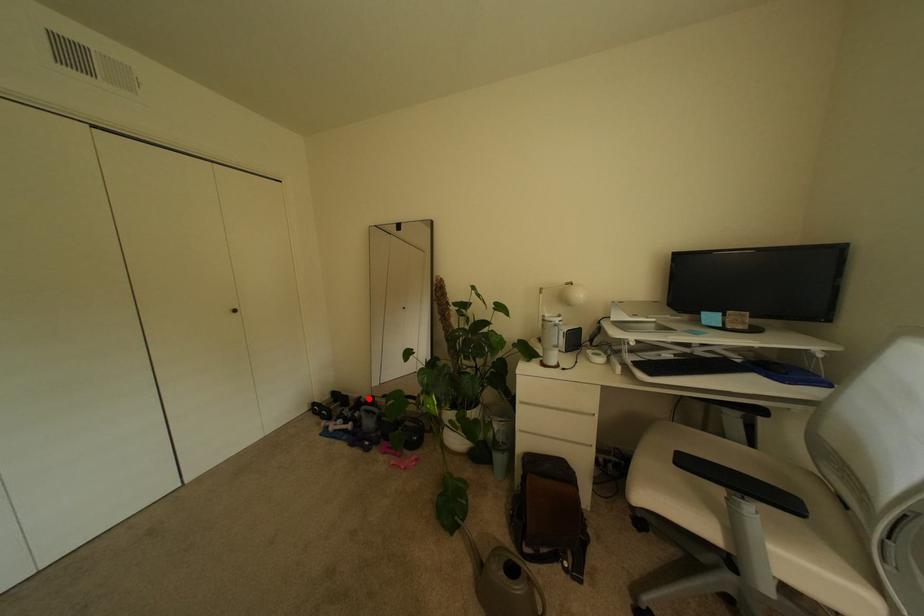
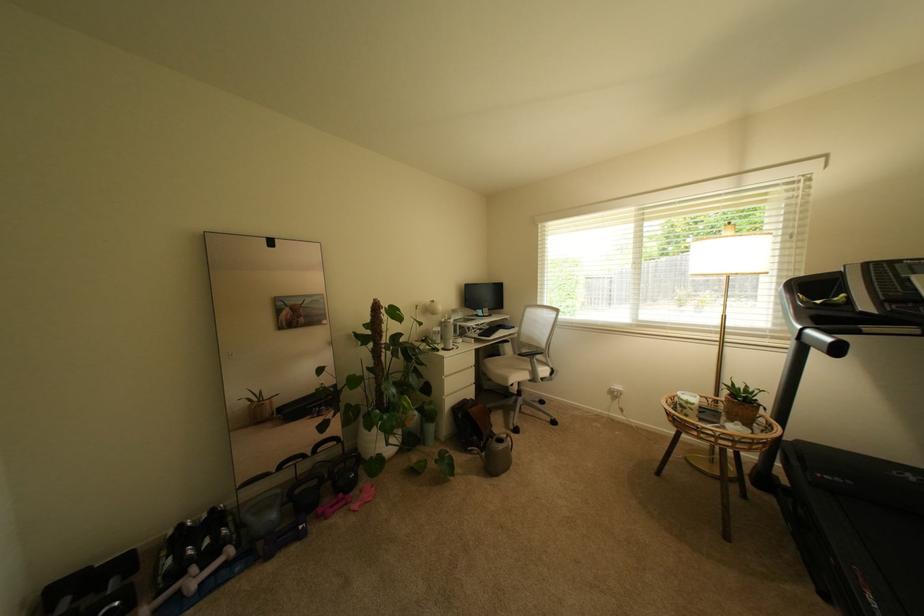
Question: I am providing you with two images of the same scene from different viewpoints. A red point is shown in image1. For the corresponding object point in image2, is it positioned nearer or farther from the camera?

Choices:
 (A) Nearer
 (B) Farther

Answer: (B)